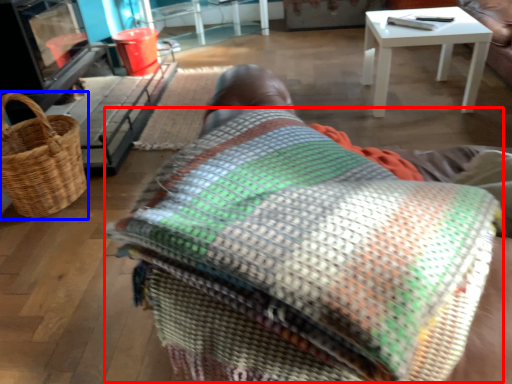
Question: Which point is further to the camera, blanket (highlighted by a red box) or picnic basket (highlighted by a blue box)?

Choices:
 (A) blanket
 (B) picnic basket

Answer: (B)